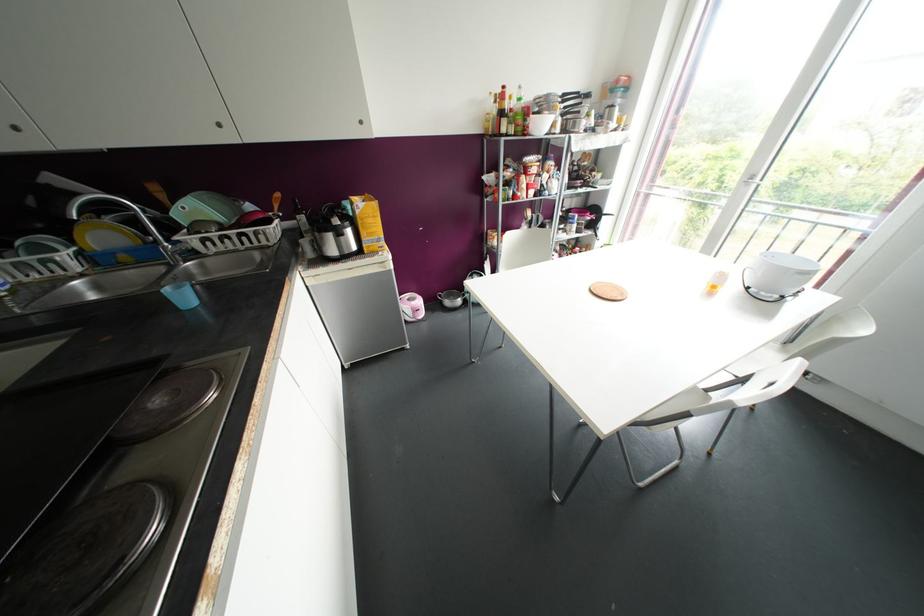
Where would you lift the yellow cereal box? Please return your answer as a coordinate pair (x, y).

(368, 223)